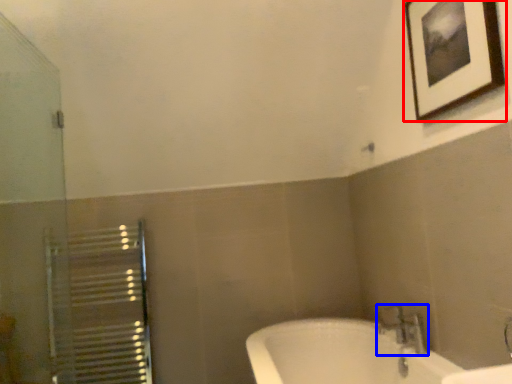
Question: Which point is further to the camera, picture frame (highlighted by a red box) or tap (highlighted by a blue box)?

Choices:
 (A) picture frame
 (B) tap

Answer: (B)